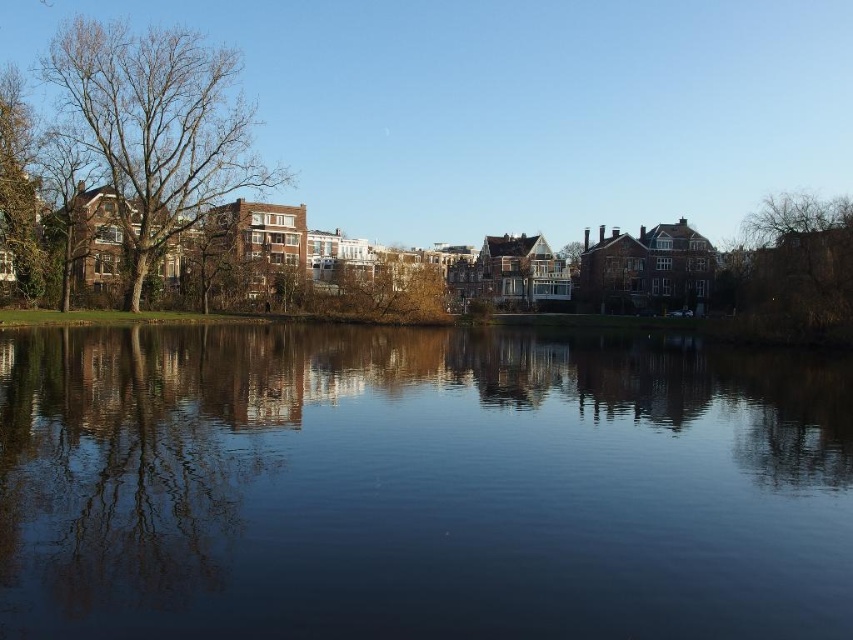
Question: Among these points, which one is farthest from the camera?

Choices:
 (A) (347, 294)
 (B) (570, 260)

Answer: (B)

Question: Does bare branches at left have a greater width compared to brown leafy tree at center?

Choices:
 (A) no
 (B) yes

Answer: (B)

Question: Which point is closer to the camera?

Choices:
 (A) bare branches at right
 (B) brown leafy tree at center

Answer: (A)

Question: Which point is closer to the camera taking this photo?

Choices:
 (A) [561, 248]
 (B) [379, 300]
 (C) [122, 36]
 (D) [544, 451]

Answer: (D)

Question: Is bare branches at left smaller than brown wood tree at center?

Choices:
 (A) yes
 (B) no

Answer: (B)

Question: Can you confirm if bare branches at right is positioned below brown leafy tree at center?

Choices:
 (A) no
 (B) yes

Answer: (A)